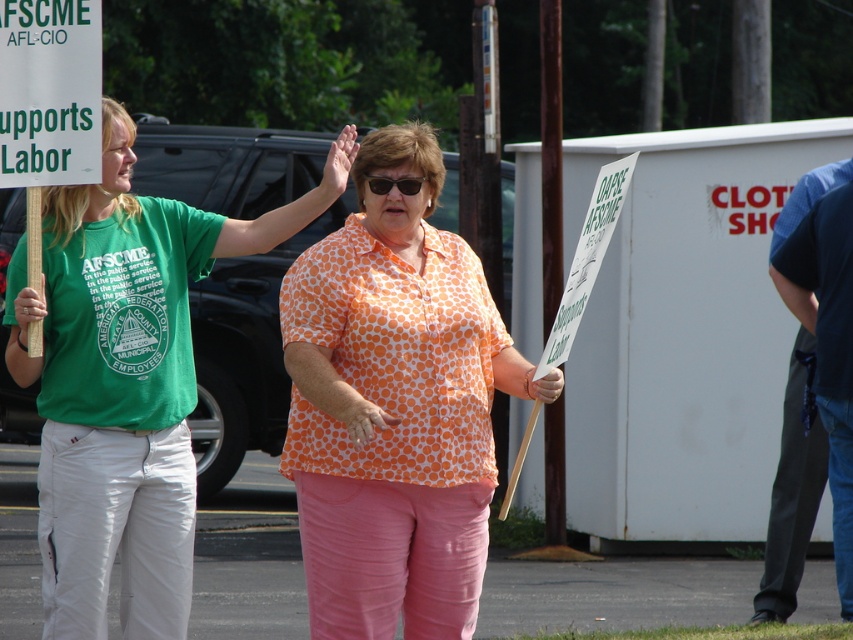
Can you confirm if orange dotted shirt at center is smaller than black plastic sunglasses at center?

Actually, orange dotted shirt at center might be larger than black plastic sunglasses at center.

Is point (468, 557) positioned in front of point (407, 192)?

That is False.

Where is `orange dotted shirt at center`? This screenshot has height=640, width=853. orange dotted shirt at center is located at coordinates (393, 406).

Can you confirm if green fabric shirt at left is positioned to the right of black plastic sunglasses at center?

Incorrect, green fabric shirt at left is not on the right side of black plastic sunglasses at center.

Does point (149, 621) come closer to viewer compared to point (407, 193)?

No, (149, 621) is further to viewer.

The width and height of the screenshot is (853, 640). What are the coordinates of `green fabric shirt at left` in the screenshot? It's located at (125, 381).

Which of these two, orange dotted shirt at center or green fabric shirt at left, stands shorter?

With less height is orange dotted shirt at center.

Is orange dotted shirt at center shorter than green fabric shirt at left?

Yes, orange dotted shirt at center is shorter than green fabric shirt at left.

Measure the distance between point (302, 360) and camera.

A distance of 6.23 meters exists between point (302, 360) and camera.

The width and height of the screenshot is (853, 640). What are the coordinates of `orange dotted shirt at center` in the screenshot? It's located at (393, 406).